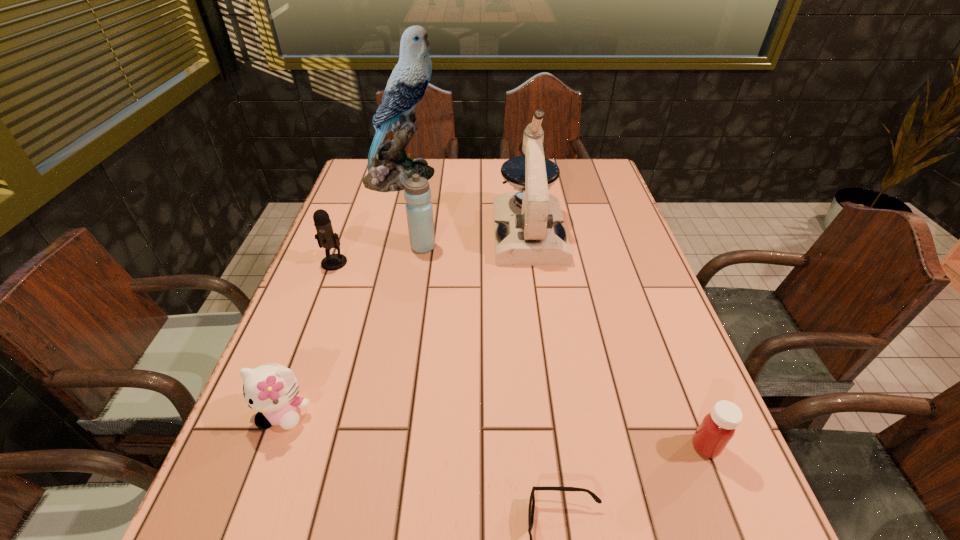
The height and width of the screenshot is (540, 960). Identify the location of free region at the near edge of the desktop. (314, 525).

Where is `vacant space at the left edge of the desktop`? vacant space at the left edge of the desktop is located at coordinates (293, 368).

At what (x,y) coordinates should I click in order to perform the action: click on vacant space at the right edge of the desktop. Please return your answer as a coordinate pair (x, y). Looking at the image, I should click on (609, 222).

Where is `free space between the water bottle and the kitten`? This screenshot has height=540, width=960. free space between the water bottle and the kitten is located at coordinates (353, 330).

Where is `free space that is in between the kitten and the third tallest object`? This screenshot has width=960, height=540. free space that is in between the kitten and the third tallest object is located at coordinates tap(353, 330).

Find the location of a particular element. object that is the fifth closest to the kitten is located at coordinates (717, 428).

The image size is (960, 540). What are the coordinates of `the sixth closest object to the kitten` in the screenshot? It's located at (389, 166).

The image size is (960, 540). Find the location of `free spot that satisfies the following two spatial constraints: 1. on the face of the medicine; 2. on the right side of the tallest object`. free spot that satisfies the following two spatial constraints: 1. on the face of the medicine; 2. on the right side of the tallest object is located at coordinates pos(331,447).

Locate an element on the screen. vacant region that satisfies the following two spatial constraints: 1. on the face of the tallest object; 2. on the left side of the water bottle is located at coordinates (383, 247).

Where is `blank area in the image that satisfies the following two spatial constraints: 1. on the front-facing side of the kitten; 2. on the left side of the medicine`? This screenshot has height=540, width=960. blank area in the image that satisfies the following two spatial constraints: 1. on the front-facing side of the kitten; 2. on the left side of the medicine is located at coordinates pos(271,447).